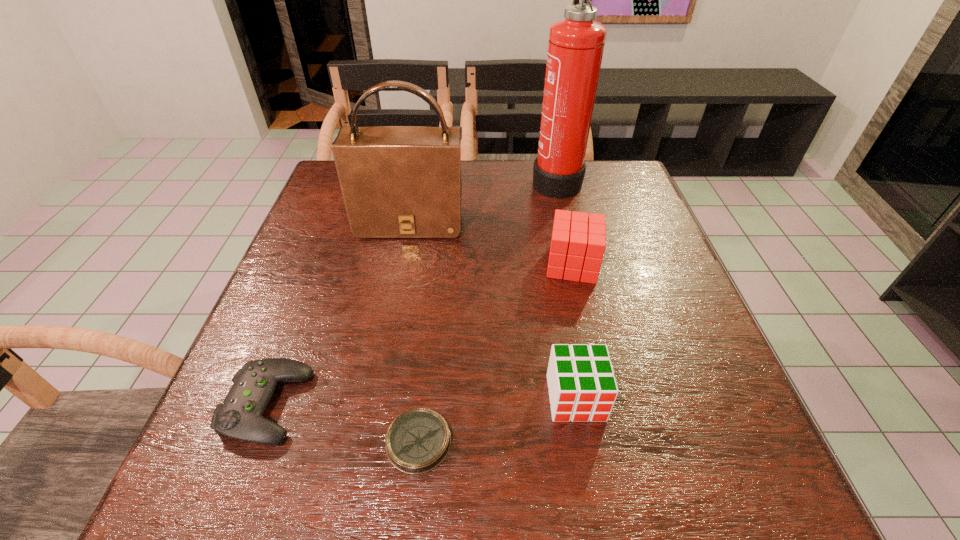
Locate an element on the screen. This screenshot has width=960, height=540. fire extinguisher is located at coordinates (575, 49).

The height and width of the screenshot is (540, 960). In order to click on the farthest object in this screenshot , I will do `click(575, 49)`.

The image size is (960, 540). I want to click on the fifth nearest object, so click(397, 181).

Locate an element on the screen. This screenshot has width=960, height=540. the second tallest object is located at coordinates (397, 181).

Find the location of a particular element. Image resolution: width=960 pixels, height=540 pixels. the fourth shortest object is located at coordinates (577, 248).

The width and height of the screenshot is (960, 540). What are the coordinates of `the taller cube` in the screenshot? It's located at (577, 248).

The height and width of the screenshot is (540, 960). In order to click on the third shortest object in this screenshot , I will do `click(582, 386)`.

This screenshot has width=960, height=540. In order to click on the nearer cube in this screenshot , I will do `click(582, 386)`.

Locate an element on the screen. The image size is (960, 540). control is located at coordinates (240, 417).

The height and width of the screenshot is (540, 960). In order to click on compass in this screenshot , I will do `click(418, 440)`.